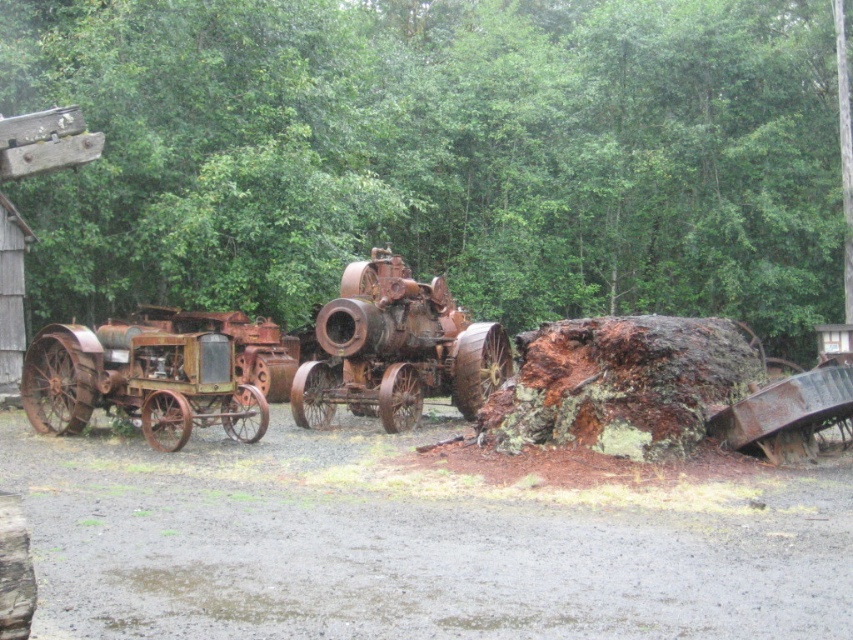
From the picture: You are standing at the origin point in the image. Which direction should you move to reach the rusty metal tractor at center?

The rusty metal tractor at center is located at point (393, 349), so you should move towards the center of the image to reach it.

You are a farmer trying to move both rusty metal tractor at center and rusty metal tractor at left out of a narrow field path. Which tractor should you move first to ensure the path remains accessible for your equipment?

The rusty metal tractor at center has a lesser width compared to the rusty metal tractor at left. Therefore, you should move the rusty metal tractor at left first, as it is wider and occupying more space on the path, allowing the narrower rusty metal tractor at center to be moved afterward without blocking the path.